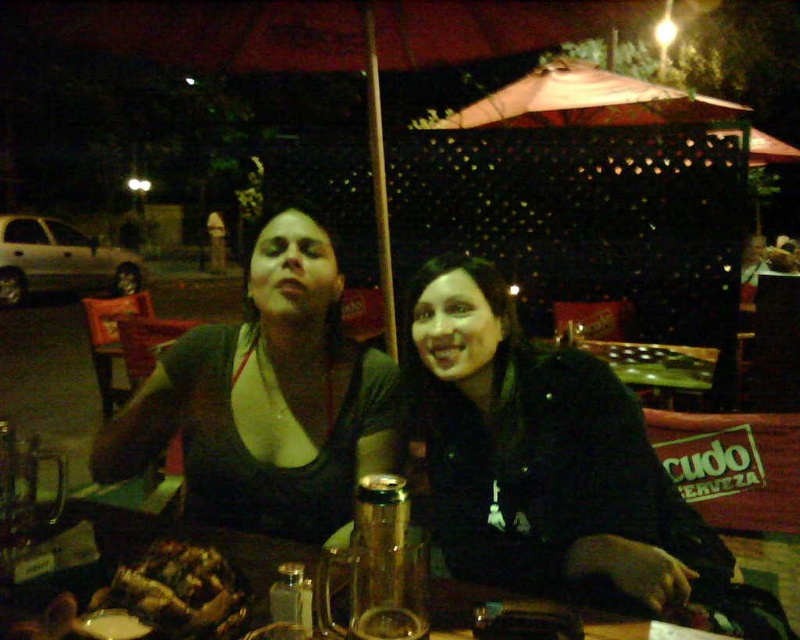
Is black matte jacket at center bigger than matte black top at center?

Indeed, black matte jacket at center has a larger size compared to matte black top at center.

At what (x,y) coordinates should I click in order to perform the action: click on black matte jacket at center. Please return your answer as a coordinate pair (x, y). Looking at the image, I should click on (542, 458).

Is brown crispy chicken at lower left closer to the viewer compared to translucent glass table at center?

No, it is behind translucent glass table at center.

Is point (226, 620) positioned behind point (454, 586)?

No, (226, 620) is closer to viewer.

The width and height of the screenshot is (800, 640). In order to click on brown crispy chicken at lower left in this screenshot , I will do `click(178, 592)`.

Describe the element at coordinates (542, 458) in the screenshot. The height and width of the screenshot is (640, 800). I see `black matte jacket at center` at that location.

Is black matte jacket at center shorter than brown crispy chicken at lower left?

No.

The image size is (800, 640). What do you see at coordinates (542, 458) in the screenshot?
I see `black matte jacket at center` at bounding box center [542, 458].

Locate an element on the screen. black matte jacket at center is located at coordinates (542, 458).